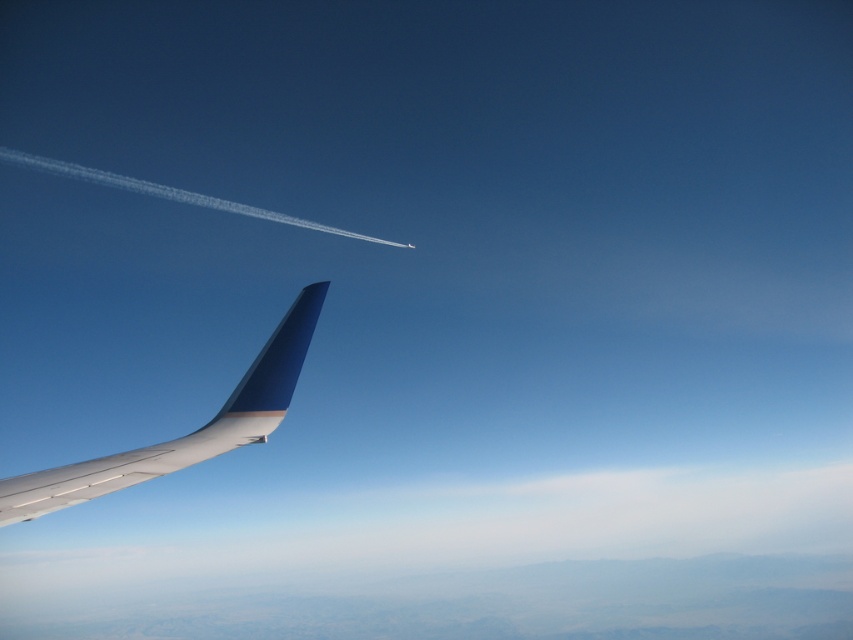
Who is positioned more to the left, white fluffy cloud at lower center or metallic blue winglet at lower left?

Positioned to the left is white fluffy cloud at lower center.

Which of these two, white fluffy cloud at lower center or metallic blue winglet at lower left, stands taller?

white fluffy cloud at lower center is taller.

Locate an element on the screen. white fluffy cloud at lower center is located at coordinates (421, 529).